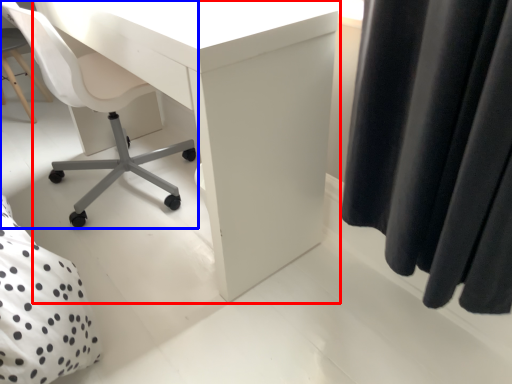
Question: Which point is further to the camera, desk (highlighted by a red box) or chair (highlighted by a blue box)?

Choices:
 (A) desk
 (B) chair

Answer: (B)